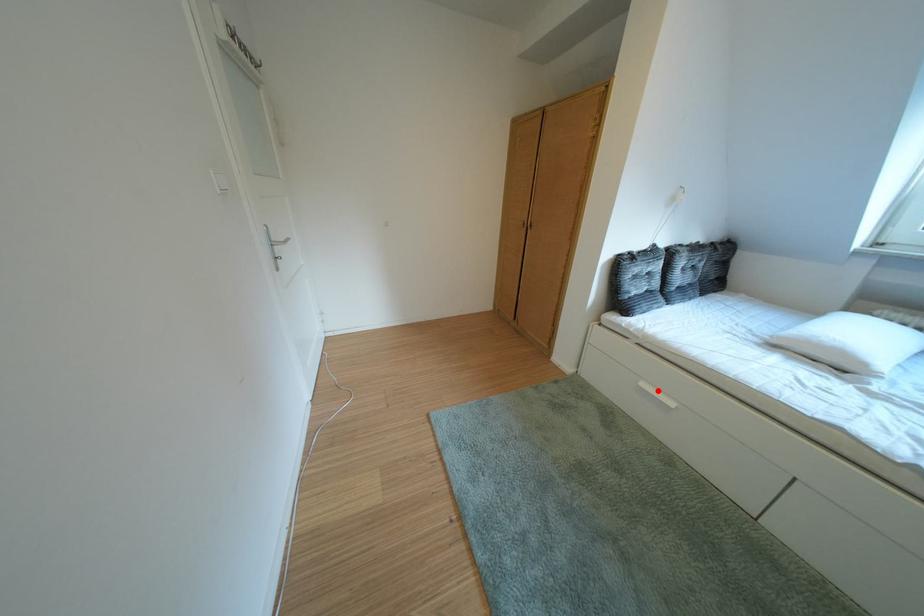
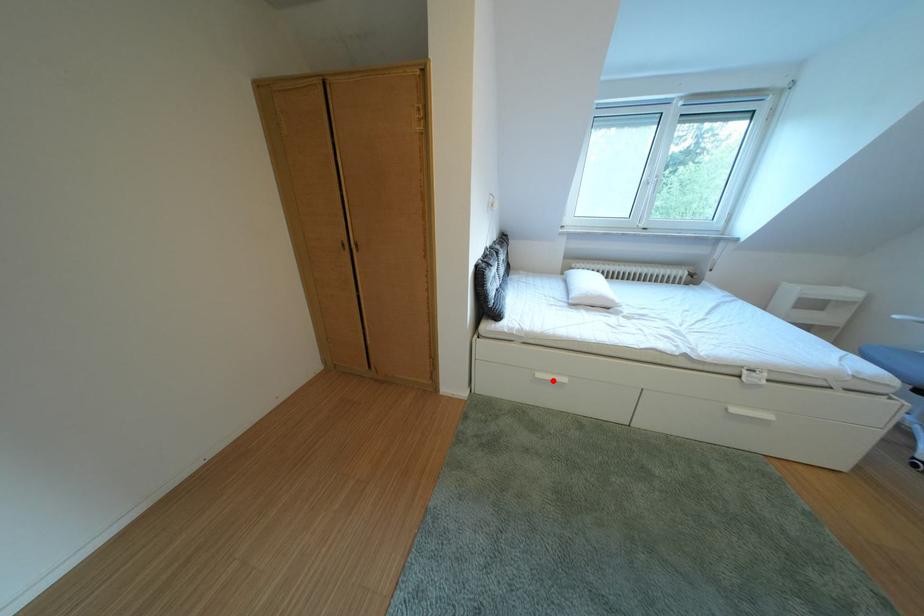
I am providing you with two images of the same scene from different viewpoints. A red point is marked on the first image and another point is marked on the second image. Is the marked point in image1 the same physical position as the marked point in image2?

Yes